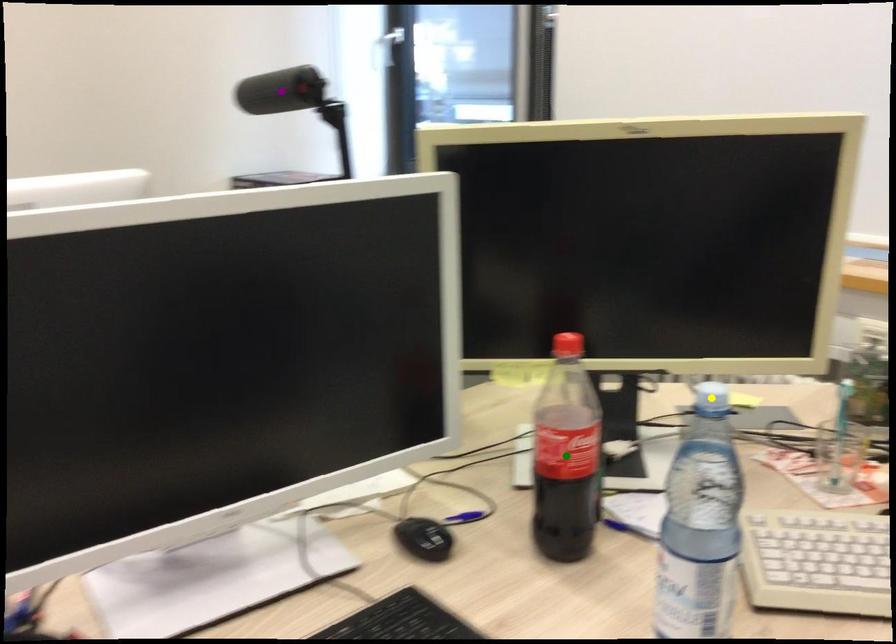
Order these from nearest to farthest:
yellow point, green point, purple point

1. yellow point
2. green point
3. purple point